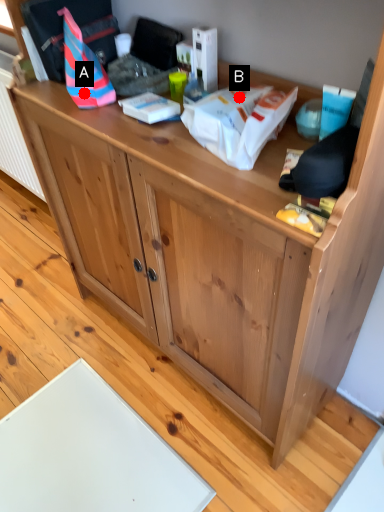
Question: Two points are circled on the image, labeled by A and B beside each circle. Which of the following is the closest to the observer?

Choices:
 (A) A is closer
 (B) B is closer

Answer: (B)